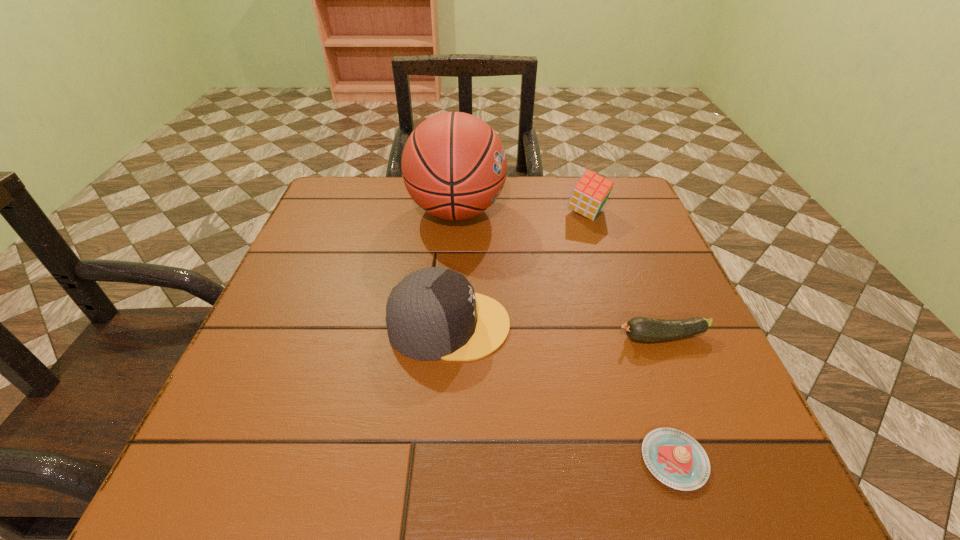
Where is `free spot that satisfies the following two spatial constraints: 1. on the front side of the nearest object; 2. on the left side of the cube`? This screenshot has width=960, height=540. free spot that satisfies the following two spatial constraints: 1. on the front side of the nearest object; 2. on the left side of the cube is located at coordinates (666, 460).